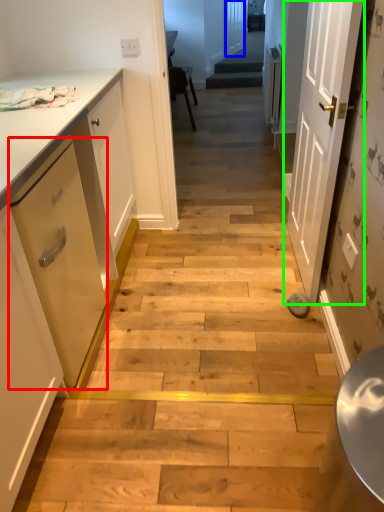
Question: Estimate the real-world distances between objects in this image. Which object is closer to drawer (highlighted by a red box), door (highlighted by a blue box) or door (highlighted by a green box)?

Choices:
 (A) door
 (B) door

Answer: (B)